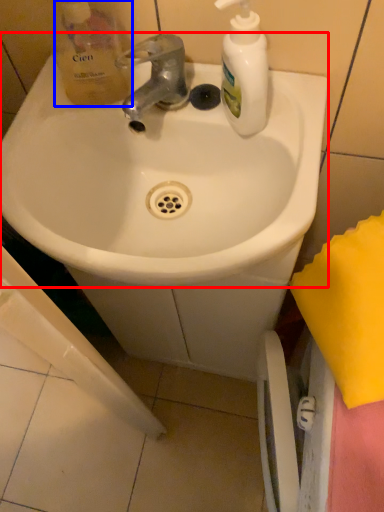
Question: Which point is further to the camera, sink (highlighted by a red box) or product (highlighted by a blue box)?

Choices:
 (A) sink
 (B) product

Answer: (B)